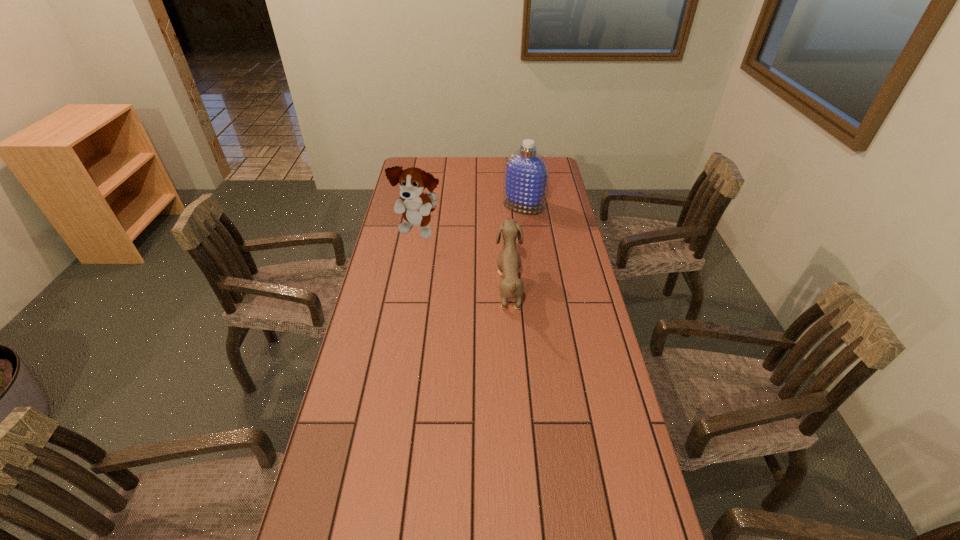
Where is `the farthest object`? Image resolution: width=960 pixels, height=540 pixels. the farthest object is located at coordinates (526, 174).

Locate an element on the screen. This screenshot has width=960, height=540. the farther puppy is located at coordinates (416, 206).

At what (x,y) coordinates should I click in order to perform the action: click on the left puppy. Please return your answer as a coordinate pair (x, y). This screenshot has width=960, height=540. Looking at the image, I should click on 416,206.

Locate an element on the screen. The width and height of the screenshot is (960, 540). the shorter puppy is located at coordinates (509, 261).

Identify the location of the shortest object. (509, 261).

Identify the location of vacant space located 0.140m on the back of the farthest object. (520, 179).

I want to click on blank space located on the face of the left puppy, so click(409, 286).

What are the coordinates of `vacant space located at the face of the shortest object` in the screenshot? It's located at (469, 286).

Locate an element on the screen. This screenshot has height=540, width=960. vacant position located at the face of the shortest object is located at coordinates (395, 286).

Image resolution: width=960 pixels, height=540 pixels. Find the location of `vacant space situated at the face of the shortest object`. vacant space situated at the face of the shortest object is located at coordinates (437, 286).